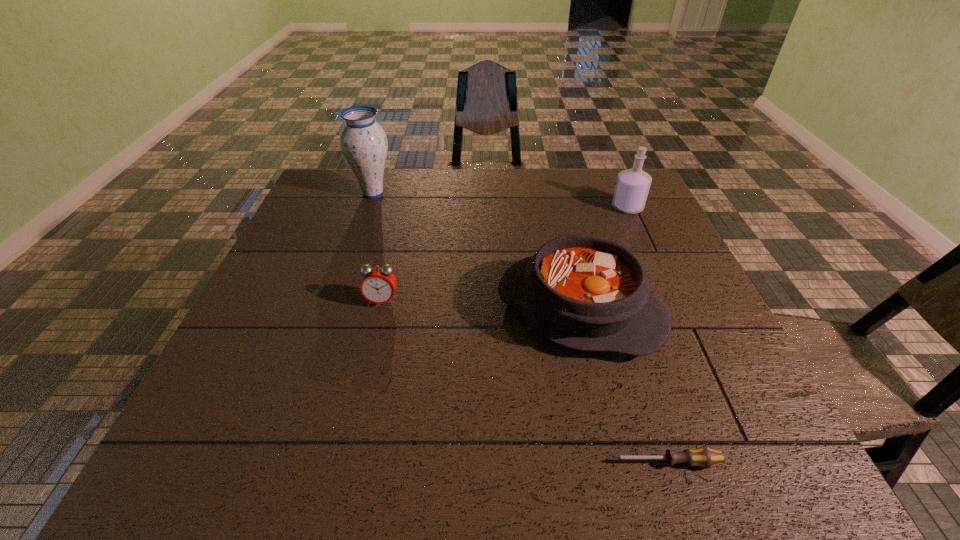
The image size is (960, 540). Find the location of `vacant space located on the left of the third tallest object`. vacant space located on the left of the third tallest object is located at coordinates (357, 310).

I want to click on free spot located 0.130m on the front-facing side of the alarm clock, so click(x=370, y=354).

Where is `free space located at the tip of the shortest object`? The height and width of the screenshot is (540, 960). free space located at the tip of the shortest object is located at coordinates (546, 462).

Image resolution: width=960 pixels, height=540 pixels. Find the location of `free space located at the tip of the shortest object`. free space located at the tip of the shortest object is located at coordinates (559, 462).

Identify the location of vacant space located 0.320m at the tip of the shortest object. The image size is (960, 540). (421, 462).

Identify the location of vase present at the far edge. (363, 142).

Where is `perfume situated at the far edge`? The image size is (960, 540). perfume situated at the far edge is located at coordinates (632, 187).

Locate an element on the screen. object situated at the near edge is located at coordinates (704, 457).

Locate an element on the screen. object that is at the left edge is located at coordinates (363, 142).

Identify the location of perfume located at the right edge. (632, 187).